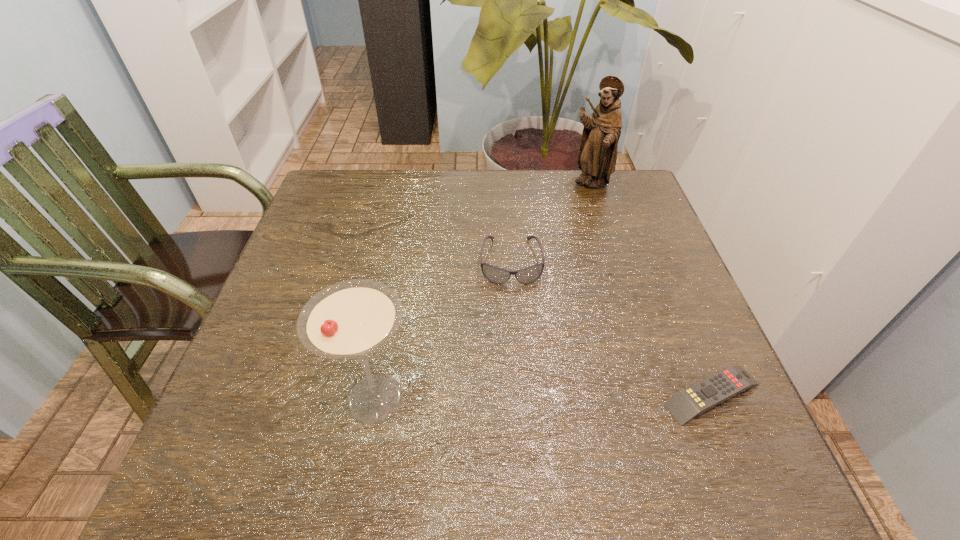
Find the location of a particular element. The width and height of the screenshot is (960, 540). the leftmost object is located at coordinates (350, 319).

The width and height of the screenshot is (960, 540). I want to click on martini, so click(350, 319).

Where is `remote control`? Image resolution: width=960 pixels, height=540 pixels. remote control is located at coordinates (712, 391).

Image resolution: width=960 pixels, height=540 pixels. Identify the location of figurine. (597, 156).

Where is `the farthest object`? This screenshot has height=540, width=960. the farthest object is located at coordinates (597, 156).

The image size is (960, 540). Find the location of `sunglasses`. sunglasses is located at coordinates (497, 275).

The height and width of the screenshot is (540, 960). Identify the location of the third nearest object. (497, 275).

This screenshot has width=960, height=540. I want to click on free space located 0.090m on the back of the leftmost object, so click(x=390, y=326).

The image size is (960, 540). What are the coordinates of `vacant space located on the left of the shortest object` in the screenshot? It's located at (604, 394).

The height and width of the screenshot is (540, 960). Identify the location of vacant space located on the front-facing side of the farthest object. (579, 281).